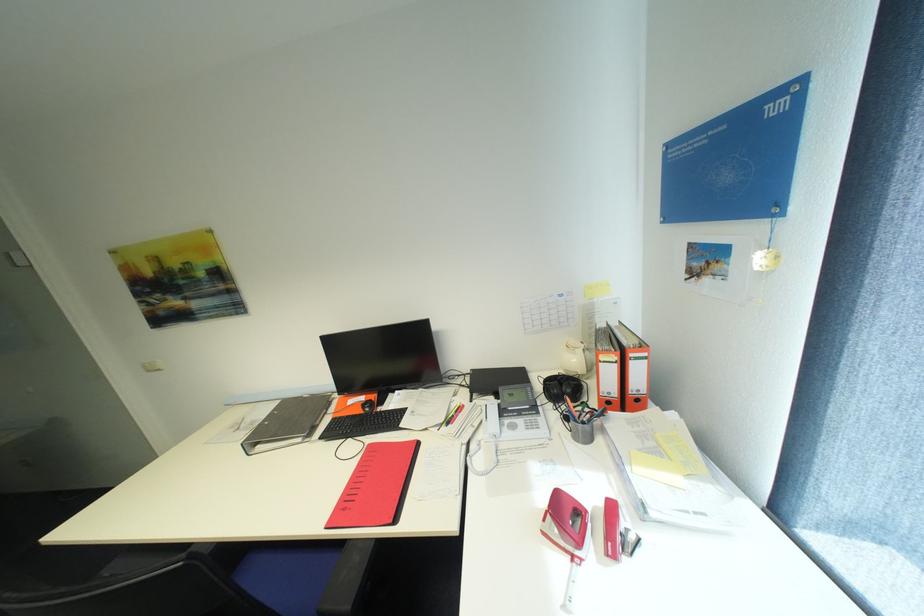
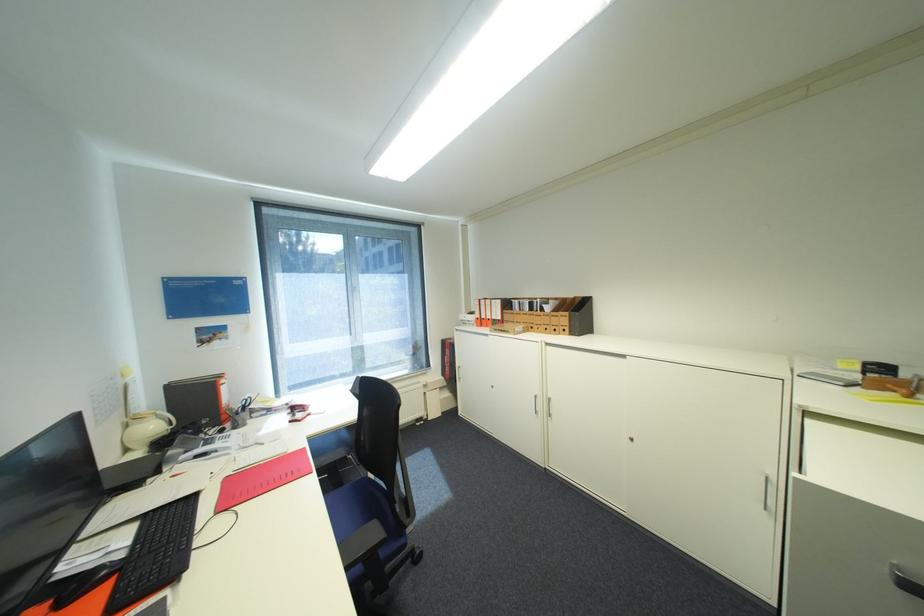
Where in the second image is the point corresponding to (582,361) from the first image?

(161, 427)